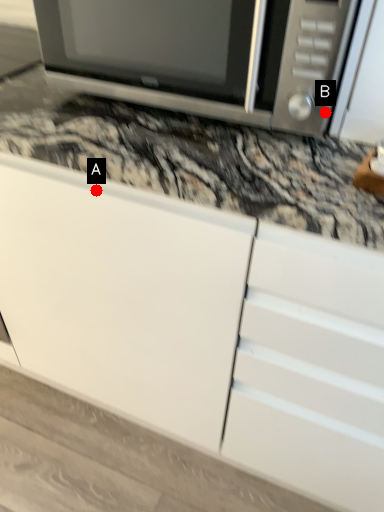
Question: Two points are circled on the image, labeled by A and B beside each circle. Among these points, which one is farthest from the camera?

Choices:
 (A) A is further
 (B) B is further

Answer: (A)